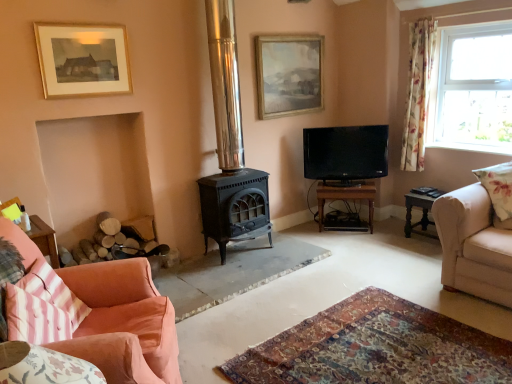
Identify the location of free space in front of brown wooden table at center, the second table when ordered from right to left. This screenshot has width=512, height=384. pyautogui.click(x=364, y=238).